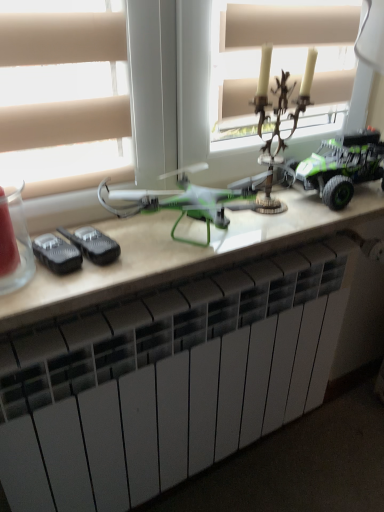
Question: Would you consider white matte radiator at lower center to be distant from antique bronze candlestick at upper center, the 2th toy positioned from the right?

Choices:
 (A) yes
 (B) no

Answer: (B)

Question: Is white matte radiator at lower center taller than antique bronze candlestick at upper center, the 2th toy positioned from the right?

Choices:
 (A) no
 (B) yes

Answer: (B)

Question: Does white matte radiator at lower center have a lesser width compared to antique bronze candlestick at upper center, the 2th toy positioned from the right?

Choices:
 (A) no
 (B) yes

Answer: (A)

Question: Is white matte radiator at lower center not inside antique bronze candlestick at upper center, the 2th toy positioned from the right?

Choices:
 (A) no
 (B) yes

Answer: (B)

Question: Is white matte radiator at lower center positioned before antique bronze candlestick at upper center, which is the first toy in left-to-right order?

Choices:
 (A) yes
 (B) no

Answer: (A)

Question: Does white matte radiator at lower center appear on the left side of antique bronze candlestick at upper center, which is the first toy in left-to-right order?

Choices:
 (A) no
 (B) yes

Answer: (B)

Question: From a real-world perspective, is antique bronze candlestick at upper center, which is the first toy in left-to-right order, physically below white matte radiator at lower center?

Choices:
 (A) yes
 (B) no

Answer: (B)

Question: Is antique bronze candlestick at upper center, the 2th toy positioned from the right, far from white matte radiator at lower center?

Choices:
 (A) no
 (B) yes

Answer: (A)

Question: From the image's perspective, is antique bronze candlestick at upper center, which is the first toy in left-to-right order, located beneath white matte radiator at lower center?

Choices:
 (A) no
 (B) yes

Answer: (A)

Question: Is antique bronze candlestick at upper center, which is the first toy in left-to-right order, directly adjacent to white matte radiator at lower center?

Choices:
 (A) no
 (B) yes

Answer: (A)

Question: Is antique bronze candlestick at upper center, which is the first toy in left-to-right order, bigger than white matte radiator at lower center?

Choices:
 (A) no
 (B) yes

Answer: (A)

Question: Considering the relative positions of antique bronze candlestick at upper center, the 2th toy positioned from the right, and white matte radiator at lower center in the image provided, is antique bronze candlestick at upper center, the 2th toy positioned from the right, in front of white matte radiator at lower center?

Choices:
 (A) yes
 (B) no

Answer: (B)

Question: Is green plastic drone at center shorter than green matte toy truck at right, the 1th toy viewed from the right?

Choices:
 (A) no
 (B) yes

Answer: (B)